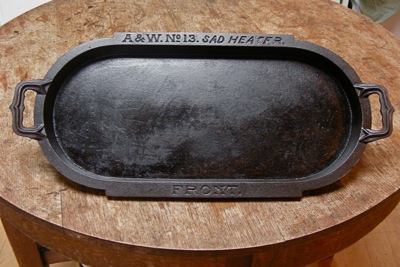
Where is `cast iron frying pan`? Image resolution: width=400 pixels, height=267 pixels. cast iron frying pan is located at coordinates (123, 70).